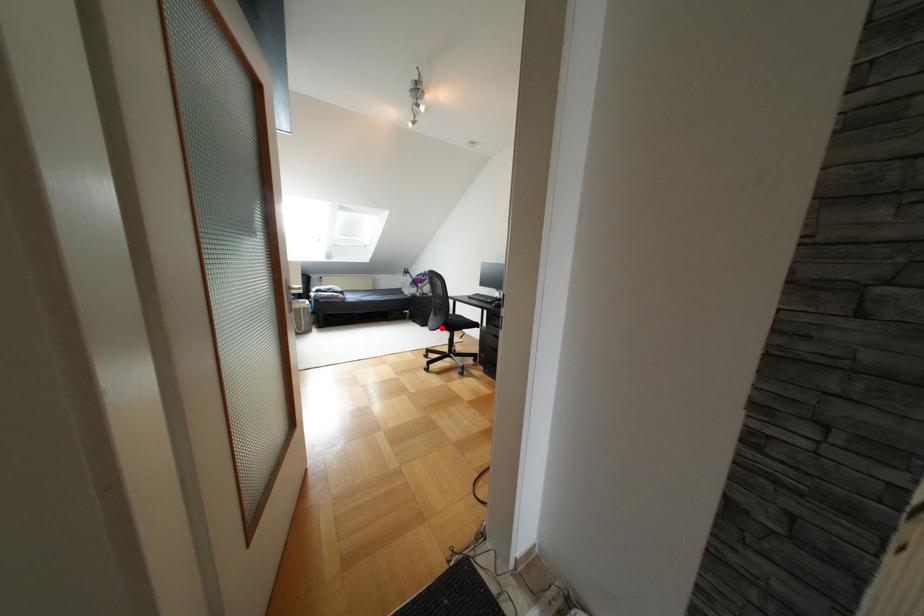
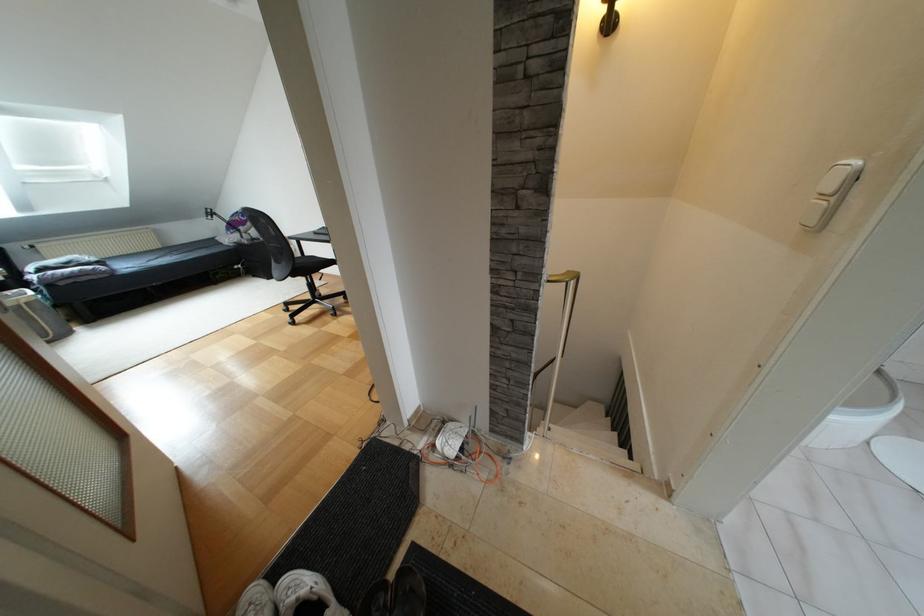
Question: I am providing you with two images of the same scene from different viewpoints. A red point is shown in image1. For the corresponding object point in image2, is it positioned nearer or farther from the camera?

Choices:
 (A) Nearer
 (B) Farther

Answer: (A)